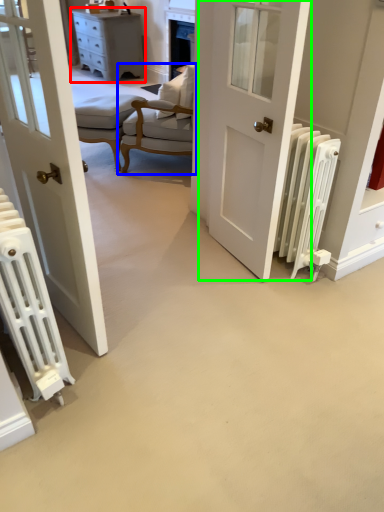
Question: Estimate the real-world distances between objects in this image. Which object is farther from chest of drawers (highlighted by a red box), chair (highlighted by a blue box) or door (highlighted by a green box)?

Choices:
 (A) chair
 (B) door

Answer: (B)